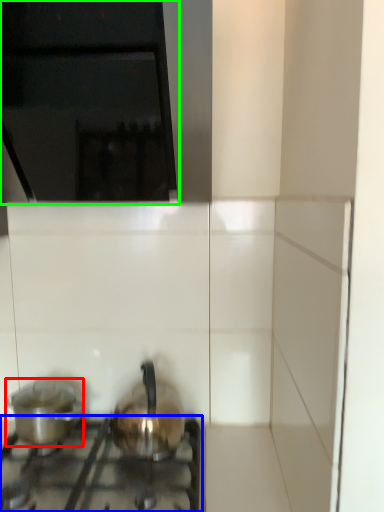
Question: Estimate the real-world distances between objects in this image. Which object is closer to kitchen appliance (highlighted by a red box), gas stove (highlighted by a blue box) or vent (highlighted by a green box)?

Choices:
 (A) gas stove
 (B) vent

Answer: (A)